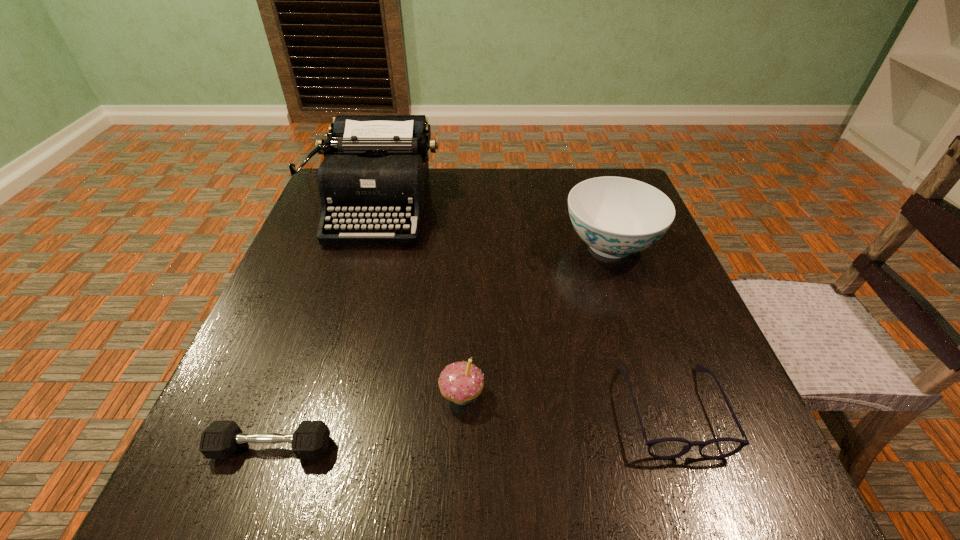
At what (x,y) coordinates should I click in order to perform the action: click on blank space that satisfies the following two spatial constraints: 1. on the back side of the third object from right to left; 2. on the left side of the dumbbell. Please return your answer as a coordinate pair (x, y). Looking at the image, I should click on (290, 395).

Locate an element on the screen. Image resolution: width=960 pixels, height=540 pixels. vacant region that satisfies the following two spatial constraints: 1. on the typing side of the chinaware; 2. on the right side of the tallest object is located at coordinates (366, 245).

Locate an element on the screen. This screenshot has width=960, height=540. blank space that satisfies the following two spatial constraints: 1. on the typing side of the tallest object; 2. on the right side of the chinaware is located at coordinates (366, 245).